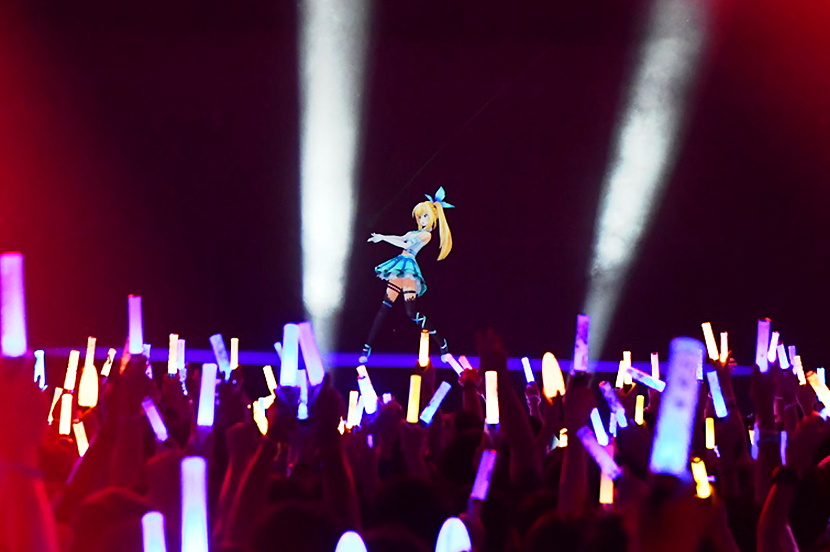
At what (x,y) coordinates should I click in order to perform the action: click on lights. Please return your answer as a coordinate pair (x, y). This screenshot has height=552, width=830. Looking at the image, I should click on (332, 246), (606, 250).